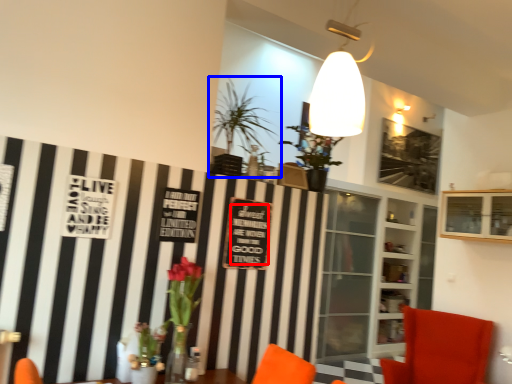
Question: Among these objects, which one is farthest to the camera, writing (highlighted by a red box) or houseplant (highlighted by a blue box)?

Choices:
 (A) writing
 (B) houseplant

Answer: (A)